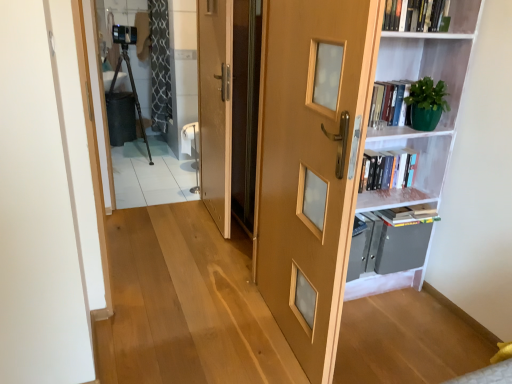
The height and width of the screenshot is (384, 512). In order to click on vacant region under light brown wooden door at center, which is the 2th door in left-to-right order (from a real-world perspective) in this screenshot , I will do `click(275, 331)`.